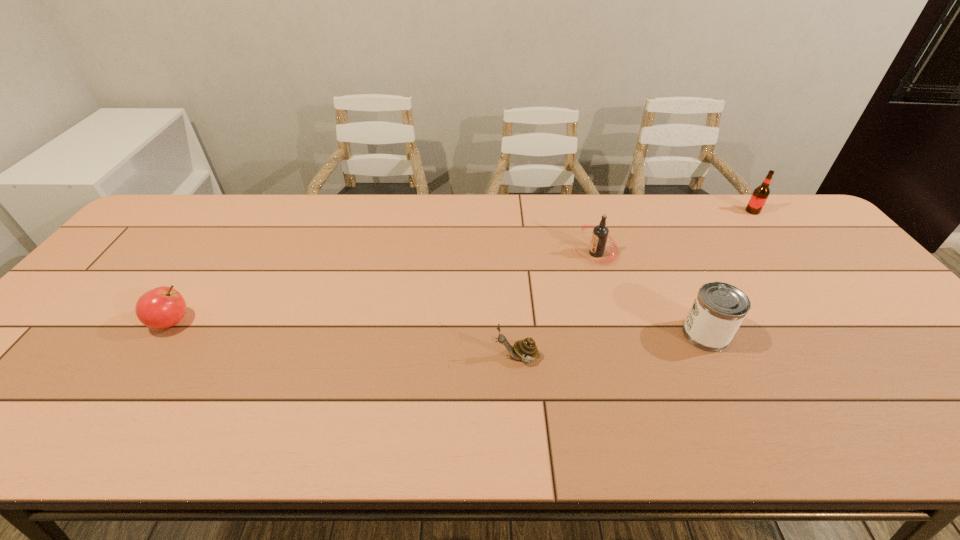
Image resolution: width=960 pixels, height=540 pixels. I want to click on blank region between the second object from right to left and the snail, so [612, 346].

Where is `free space between the second object from right to left and the apple`? Image resolution: width=960 pixels, height=540 pixels. free space between the second object from right to left and the apple is located at coordinates (439, 328).

Identify the location of free area in between the farthest object and the third object from left to right. (674, 232).

Identify the location of free spot between the snail and the third object from left to right. This screenshot has height=540, width=960. (557, 305).

The height and width of the screenshot is (540, 960). I want to click on object that is the fourth closest to the fourth nearest object, so click(162, 307).

Identify which object is the second closest to the leftmost object. Please provide its 2D coordinates. Your answer should be formatted as a tuple, i.e. [(x, y)], where the tuple contains the x and y coordinates of a point satisfying the conditions above.

[(600, 234)]

Identify the location of vacant area in the image that satisfies the following two spatial constraints: 1. on the label of the second object from right to left; 2. on the left side of the nearer root beer. (620, 334).

You are a GUI agent. You are given a task and a screenshot of the screen. Output one action in this format:
    pyautogui.click(x=<x>, y=<y>)
    Task: Click on the vacant region that satisfies the following two spatial constraints: 1. on the front side of the can; 2. on the left side of the leftmost object
    
    Given the screenshot: What is the action you would take?
    pyautogui.click(x=163, y=334)

This screenshot has width=960, height=540. Identify the location of free space that satisfies the following two spatial constraints: 1. on the label of the left root beer; 2. on the front side of the apple. (616, 322).